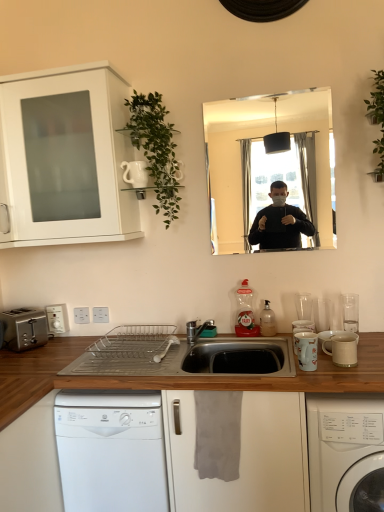
Question: Is silver metallic toaster at lower left bigger than white glossy mug at right, the first appliance viewed from the front?

Choices:
 (A) no
 (B) yes

Answer: (B)

Question: Is silver metallic toaster at lower left in contact with white glossy mug at right, the 2th appliance positioned from the left?

Choices:
 (A) no
 (B) yes

Answer: (A)

Question: Is silver metallic toaster at lower left facing towards white glossy mug at right, arranged as the second appliance when viewed from the top?

Choices:
 (A) no
 (B) yes

Answer: (B)

Question: Is silver metallic toaster at lower left taller than white glossy mug at right, the first appliance viewed from the front?

Choices:
 (A) yes
 (B) no

Answer: (A)

Question: Can you confirm if silver metallic toaster at lower left is shorter than white glossy mug at right, the 2th appliance positioned from the left?

Choices:
 (A) no
 (B) yes

Answer: (A)

Question: From a real-world perspective, is wooden countertop at center, arranged as the 1th countertop when viewed from the top, physically located above or below translucent plastic bottle at sink, the second bottle when ordered from right to left?

Choices:
 (A) below
 (B) above

Answer: (A)

Question: Considering the positions of wooden countertop at center, arranged as the 1th countertop when viewed from the top, and translucent plastic bottle at sink, marked as the 1th bottle in a left-to-right arrangement, in the image, is wooden countertop at center, arranged as the 1th countertop when viewed from the top, taller or shorter than translucent plastic bottle at sink, marked as the 1th bottle in a left-to-right arrangement,?

Choices:
 (A) tall
 (B) short

Answer: (B)

Question: Is wooden countertop at center, the 2th countertop ordered from the bottom, spatially inside translucent plastic bottle at sink, marked as the 1th bottle in a left-to-right arrangement, or outside of it?

Choices:
 (A) outside
 (B) inside

Answer: (A)

Question: Looking at the image, does wooden countertop at center, arranged as the 1th countertop when viewed from the top, seem bigger or smaller compared to translucent plastic bottle at sink, marked as the 1th bottle in a left-to-right arrangement?

Choices:
 (A) big
 (B) small

Answer: (A)

Question: Would you say white plastic dishwasher at lower center is inside or outside silver metallic toaster at lower left?

Choices:
 (A) outside
 (B) inside

Answer: (A)

Question: Is point (127, 493) closer or farther from the camera than point (26, 308)?

Choices:
 (A) closer
 (B) farther

Answer: (A)

Question: From the image's perspective, is white plastic dishwasher at lower center located above or below silver metallic toaster at lower left?

Choices:
 (A) below
 (B) above

Answer: (A)

Question: From a real-world perspective, is white plastic dishwasher at lower center positioned above or below silver metallic toaster at lower left?

Choices:
 (A) below
 (B) above

Answer: (A)

Question: Looking at their shapes, would you say wooden at lower center, the second countertop viewed from the top, is wider or thinner than white glossy washing machine at lower right?

Choices:
 (A) wide
 (B) thin

Answer: (B)

Question: From the image's perspective, is wooden at lower center, the second countertop viewed from the top, located above or below white glossy washing machine at lower right?

Choices:
 (A) below
 (B) above

Answer: (B)